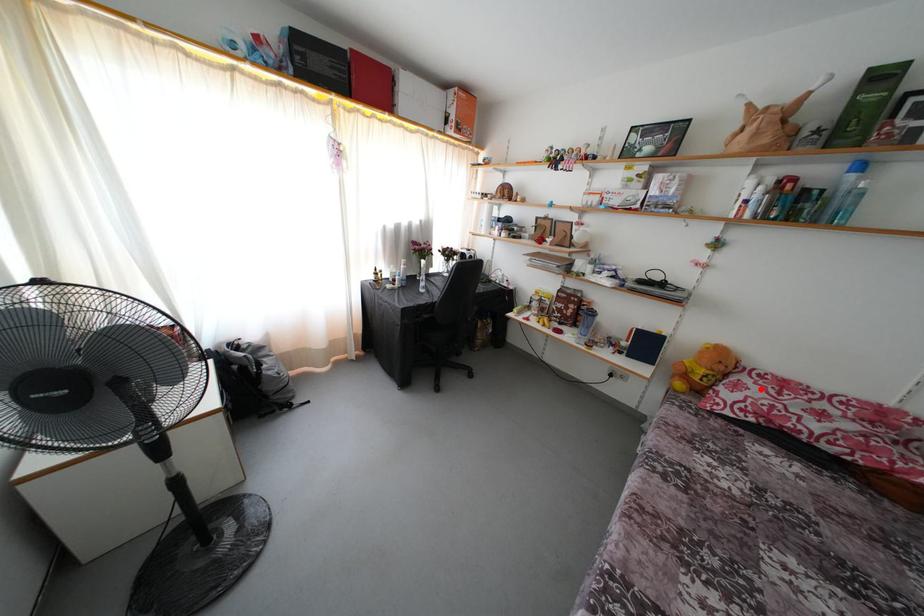
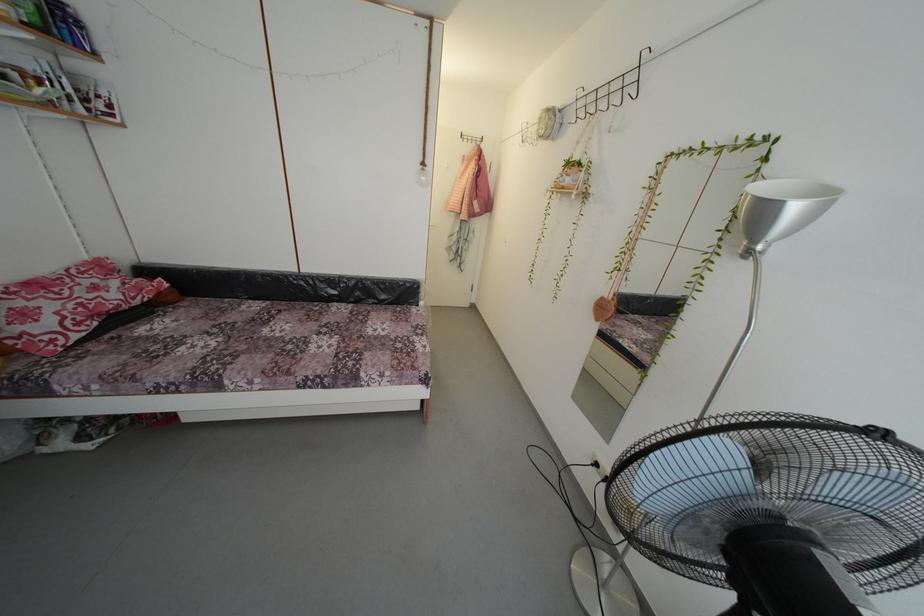
Question: I am providing you with two images of the same scene from different viewpoints. Image1 has a red point marked. In image2, the corresponding 3D location appears at what relative position? Reply with the corresponding letter.

Choices:
 (A) Closer
 (B) Farther

Answer: (B)